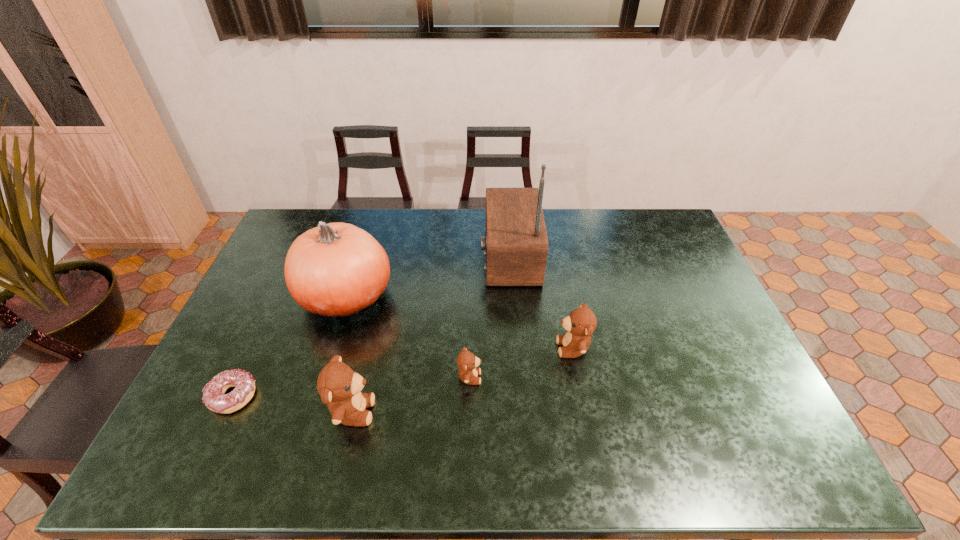
In order to click on doughnut present at the near edge in this screenshot , I will do [x=214, y=397].

The width and height of the screenshot is (960, 540). Find the location of `pumpkin that is at the left edge`. pumpkin that is at the left edge is located at coordinates (337, 269).

At what (x,y) coordinates should I click in order to perform the action: click on doughnut that is at the left edge. Please return your answer as a coordinate pair (x, y). Looking at the image, I should click on (214, 397).

Locate an element on the screen. The image size is (960, 540). object that is positioned at the near left corner is located at coordinates coord(214,397).

Identify the location of vacant region at the far edge of the desktop. This screenshot has width=960, height=540. (449, 212).

What are the coordinates of `free spot at the near edge of the desktop` in the screenshot? It's located at (632, 418).

In the image, there is a desktop. Where is `free space at the right edge`? This screenshot has width=960, height=540. free space at the right edge is located at coordinates (708, 289).

The width and height of the screenshot is (960, 540). I want to click on free space at the near left corner, so click(x=243, y=425).

You are a GUI agent. You are given a task and a screenshot of the screen. Output one action in this format:
    pyautogui.click(x=<x>, y=<y>)
    Task: Click on the free space between the leftmost teddy bear and the pumpkin
    This screenshot has height=540, width=960.
    Given the screenshot: What is the action you would take?
    pyautogui.click(x=349, y=354)

The height and width of the screenshot is (540, 960). Find the location of `free space between the pumpkin and the fifth tallest object`. free space between the pumpkin and the fifth tallest object is located at coordinates (408, 337).